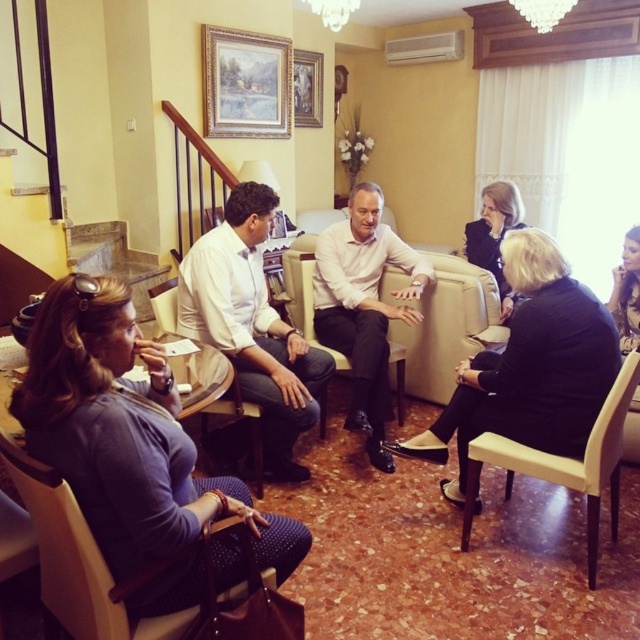
Which is behind, point (490, 237) or point (317, 115)?

Point (317, 115)

Which of these two, black leather jacket at upper right or wooden picture frame at upper center, stands shorter?

Standing shorter between the two is wooden picture frame at upper center.

Which is in front, point (499, 218) or point (316, 74)?

Positioned in front is point (499, 218).

This screenshot has width=640, height=640. In order to click on black leather jacket at upper right in this screenshot , I will do `click(493, 234)`.

Between matte purple dress at lower left and black leather jacket at upper right, which one appears on the right side from the viewer's perspective?

Positioned to the right is black leather jacket at upper right.

Does matte purple dress at lower left appear on the left side of black leather jacket at upper right?

Yes, matte purple dress at lower left is to the left of black leather jacket at upper right.

Consider the image. Who is more forward, (58,435) or (472,228)?

Point (58,435) is in front.

Where is `matte purple dress at lower left`? matte purple dress at lower left is located at coordinates (131, 445).

What do you see at coordinates (131, 445) in the screenshot? I see `matte purple dress at lower left` at bounding box center [131, 445].

Does point (161, 380) lie in front of point (234, 298)?

Yes, point (161, 380) is in front of point (234, 298).

Find the location of `matte purple dress at lower left`. matte purple dress at lower left is located at coordinates (131, 445).